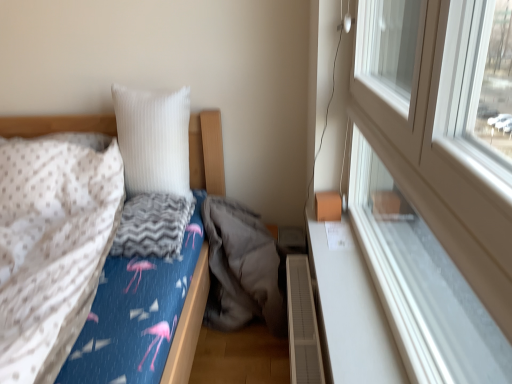
Question: Is white smooth window sill at right in front of or behind white plastic window at upper right in the image?

Choices:
 (A) behind
 (B) front

Answer: (A)

Question: From a real-world perspective, is white smooth window sill at right above or below white plastic window at upper right?

Choices:
 (A) below
 (B) above

Answer: (A)

Question: Based on their relative distances, which object is nearer to the gray soft sleeping bag at center?

Choices:
 (A) gray zigzag blanket at center
 (B) white plastic window at upper right
 (C) white plastic radiator at lower right
 (D) flamingo-patterned fabric bed at left
 (E) white ribbed pillow at upper center

Answer: (D)

Question: Which of these objects is positioned farthest from the white plastic radiator at lower right?

Choices:
 (A) white dotted fabric at left
 (B) gray soft sleeping bag at center
 (C) flamingo-patterned fabric bed at left
 (D) white plastic window at upper right
 (E) white smooth window sill at right

Answer: (A)